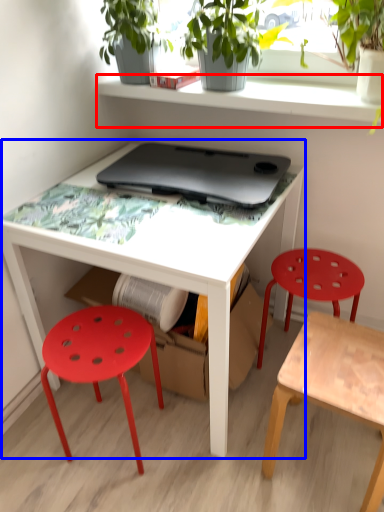
Question: Which of the following is the farthest to the observer, shelf (highlighted by a red box) or table (highlighted by a blue box)?

Choices:
 (A) shelf
 (B) table

Answer: (A)